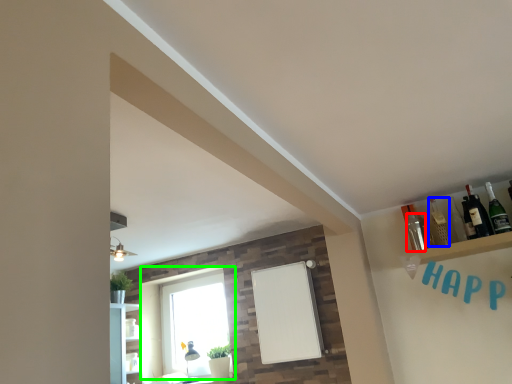
Question: Estimate the real-world distances between objects in this image. Which object is farther from bottle (highlighted by a red box), bottle (highlighted by a blue box) or window (highlighted by a green box)?

Choices:
 (A) bottle
 (B) window

Answer: (B)